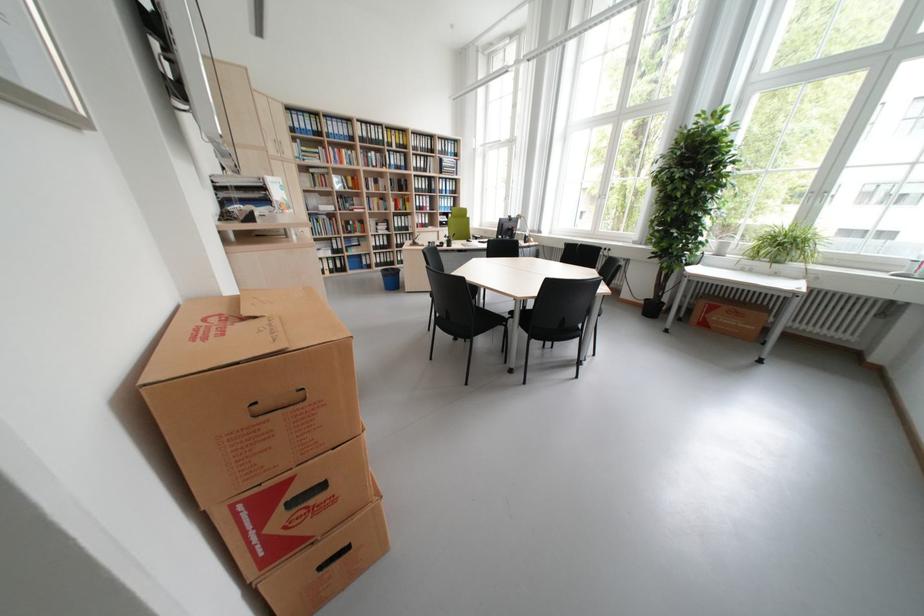
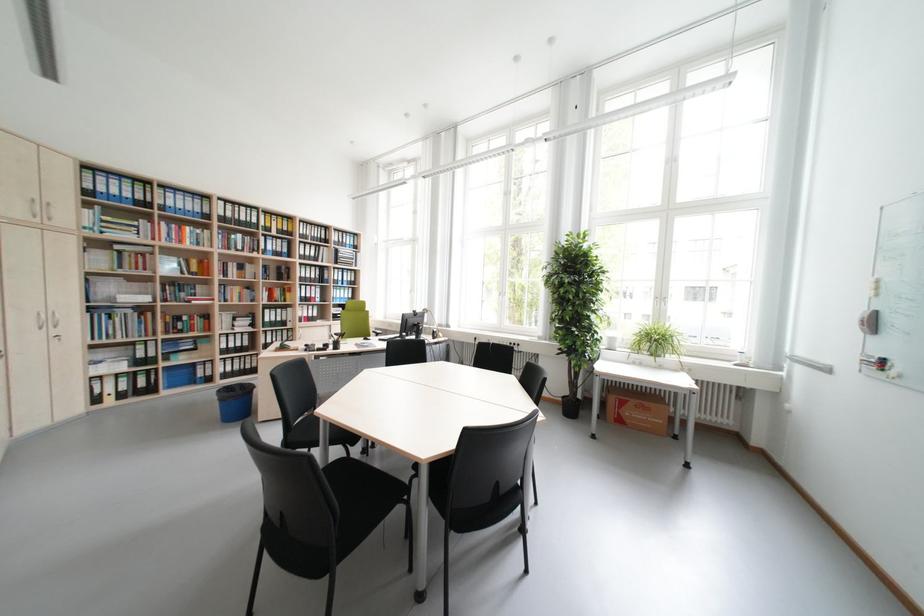
Question: What movement of the cameraman would produce the second image?

Choices:
 (A) Left
 (B) Right
 (C) Forward
 (D) Backward

Answer: (C)